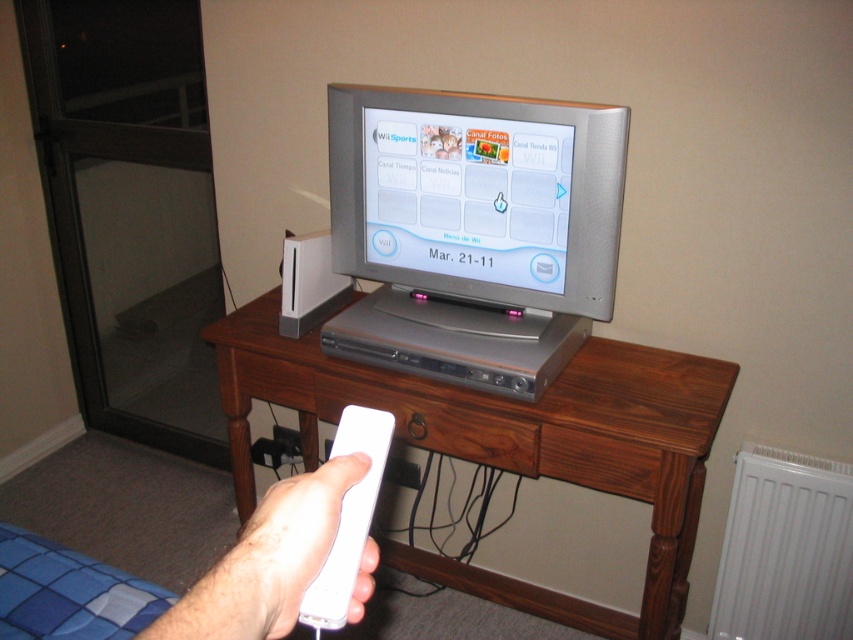
Question: Which is nearer to the white matte game controller at center?

Choices:
 (A) brown wood drawer at center
 (B) white matte remote control at lower center

Answer: (B)

Question: Which point appears farthest from the camera in this image?

Choices:
 (A) [360, 547]
 (B) [219, 371]

Answer: (B)

Question: Does white matte remote control at lower center appear over brown wood drawer at center?

Choices:
 (A) yes
 (B) no

Answer: (A)

Question: Which point appears farthest from the camera in this image?

Choices:
 (A) pyautogui.click(x=422, y=406)
 (B) pyautogui.click(x=347, y=364)
 (C) pyautogui.click(x=358, y=561)

Answer: (B)

Question: In this image, where is brown wood table at center located relative to white matte remote control at lower center?

Choices:
 (A) left
 (B) right

Answer: (B)

Question: Does brown wood table at center come behind white matte remote control at lower center?

Choices:
 (A) no
 (B) yes

Answer: (B)